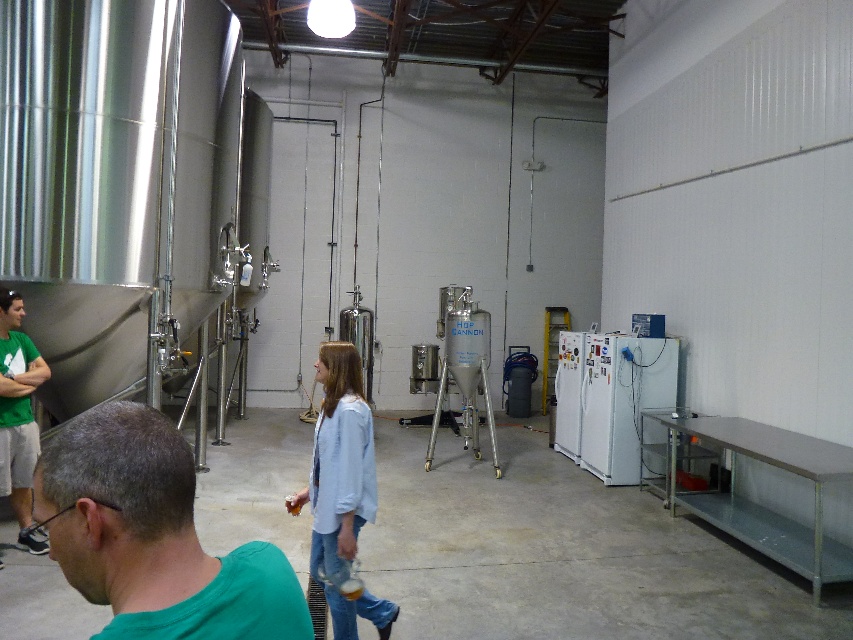
Question: Which object is farther from the camera taking this photo?

Choices:
 (A) green matte shirt at lower left
 (B) light blue denim jacket at center
 (C) green t-shirt at left
 (D) white matte refrigerator at right

Answer: (D)

Question: Does light blue denim jacket at center come behind green t-shirt at left?

Choices:
 (A) no
 (B) yes

Answer: (A)

Question: Is green matte shirt at lower left to the right of white matte refrigerator at right from the viewer's perspective?

Choices:
 (A) no
 (B) yes

Answer: (A)

Question: Among these objects, which one is farthest from the camera?

Choices:
 (A) white matte refrigerator at right
 (B) light blue denim jacket at center

Answer: (A)

Question: Which point is farther from the camera taking this photo?

Choices:
 (A) (323, 540)
 (B) (35, 381)

Answer: (B)

Question: Observing the image, what is the correct spatial positioning of green matte shirt at lower left in reference to green t-shirt at left?

Choices:
 (A) left
 (B) right

Answer: (B)